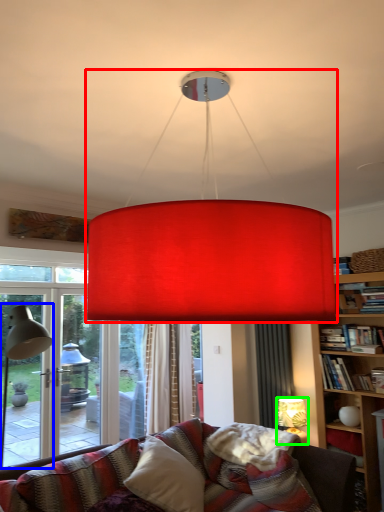
Question: Based on their relative distances, which object is nearer to lamp (highlighted by a red box)? Choose from table lamp (highlighted by a blue box) and lamp (highlighted by a green box).

Choices:
 (A) table lamp
 (B) lamp

Answer: (A)